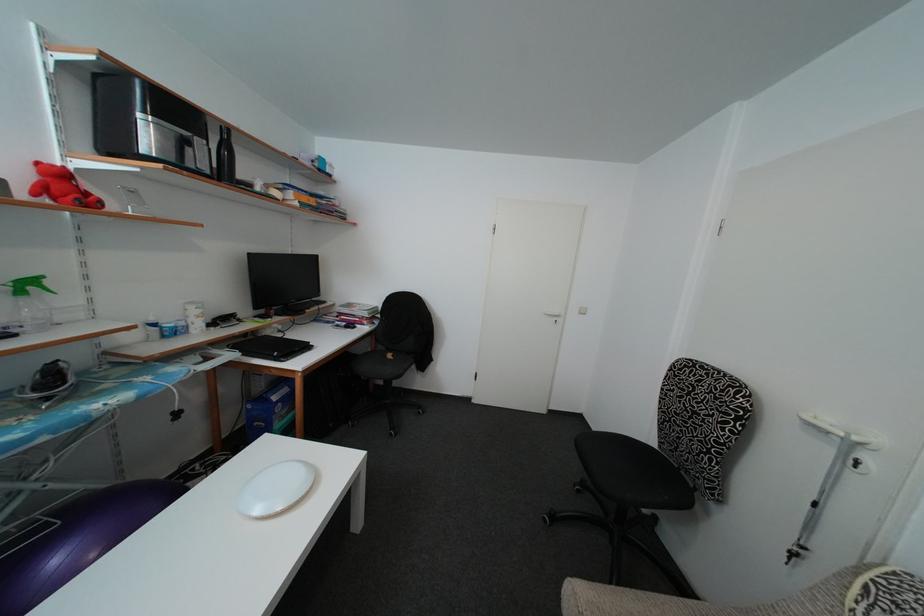
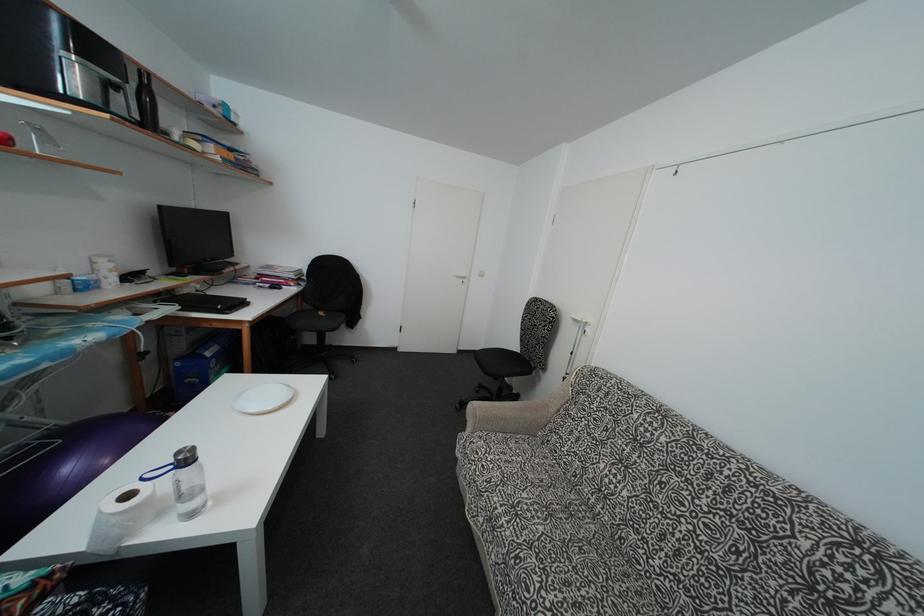
In the second image, find the point that corresponds to [650,440] in the first image.

(517, 353)